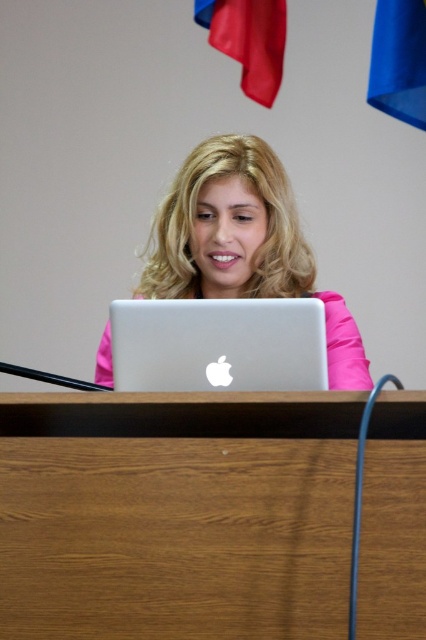
Between wooden desk at center and pink matte laptop at center, which one appears on the right side from the viewer's perspective?

wooden desk at center is more to the right.

Does wooden desk at center have a larger size compared to pink matte laptop at center?

Actually, wooden desk at center might be smaller than pink matte laptop at center.

Who is more forward, (x=190, y=499) or (x=206, y=214)?

Point (x=190, y=499) is more forward.

Locate an element on the screen. The image size is (426, 640). wooden desk at center is located at coordinates (175, 515).

The image size is (426, 640). Identify the location of pink matte laptop at center. (244, 243).

Between pink matte laptop at center and silver metallic laptop at center, which one appears on the right side from the viewer's perspective?

silver metallic laptop at center is more to the right.

Identify the location of pink matte laptop at center. (244, 243).

Locate an element on the screen. pink matte laptop at center is located at coordinates (244, 243).

Which is behind, point (250, 483) or point (276, 374)?

The point (276, 374) is behind.

Which is in front, point (325, 508) or point (236, 385)?

Positioned in front is point (325, 508).

Between point (112, 570) and point (271, 378), which one is positioned behind?

The point (271, 378) is behind.

This screenshot has width=426, height=640. What are the coordinates of `wooden desk at center` in the screenshot? It's located at (175, 515).